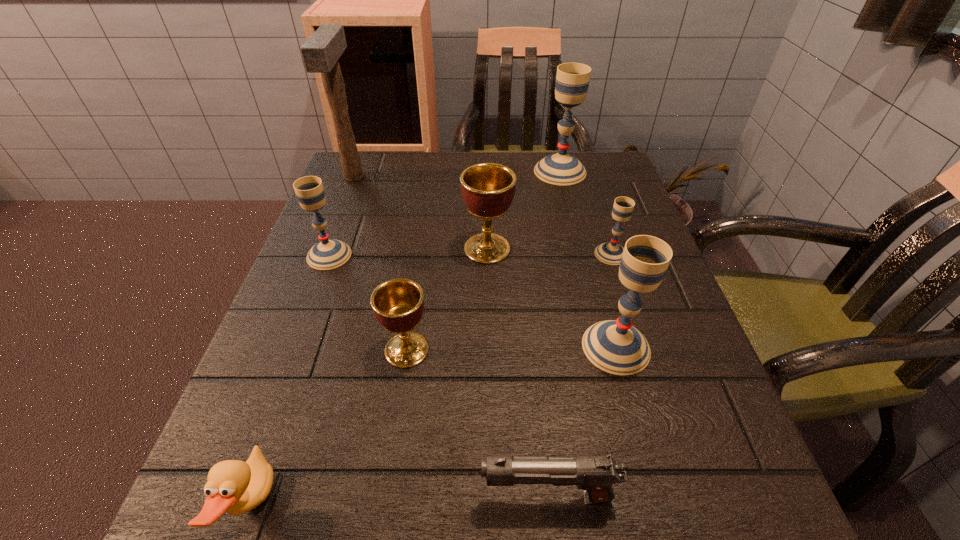
In the image, there is a desktop. Where is `vacant space at the far edge`? The width and height of the screenshot is (960, 540). vacant space at the far edge is located at coordinates (556, 194).

In the image, there is a desktop. At what (x,y) coordinates should I click in order to perform the action: click on free space at the near edge. Please return your answer as a coordinate pair (x, y). This screenshot has height=540, width=960. Looking at the image, I should click on (530, 525).

Where is `free spot at the left edge of the desktop`? free spot at the left edge of the desktop is located at coordinates (238, 414).

Image resolution: width=960 pixels, height=540 pixels. What are the coordinates of `vacant area at the right edge of the desktop` in the screenshot? It's located at (698, 382).

The image size is (960, 540). In the image, there is a desktop. What are the coordinates of `vacant space at the far left corner` in the screenshot? It's located at (366, 181).

This screenshot has width=960, height=540. Identify the location of free spot at the far right corner of the desktop. pyautogui.click(x=598, y=171).

This screenshot has height=540, width=960. I want to click on free spot between the fifth shortest chalice and the gray gun, so click(x=582, y=422).

Find the location of `vacant space that is in between the gray gun and the smallest gray chalice`. vacant space that is in between the gray gun and the smallest gray chalice is located at coordinates (580, 376).

Identify the location of empty space between the second tallest object and the mallet. The width and height of the screenshot is (960, 540). (457, 174).

The height and width of the screenshot is (540, 960). I want to click on free space that is in between the gray gun and the farthest chalice, so click(x=554, y=334).